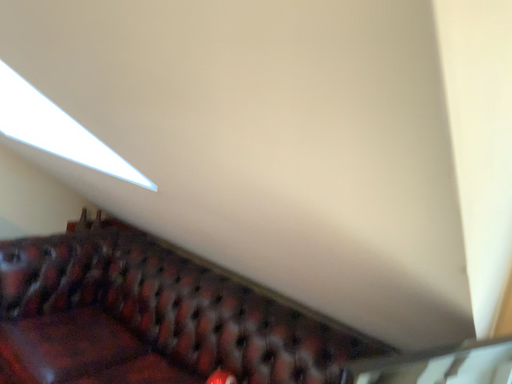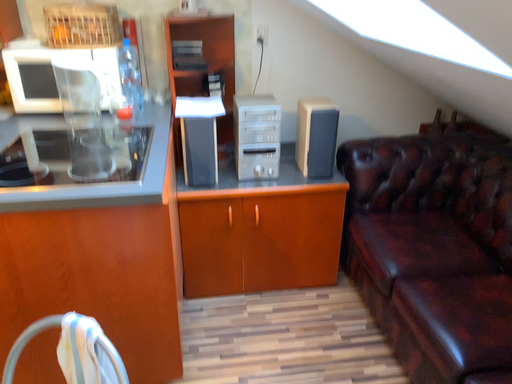
Question: Which way did the camera rotate in the video?

Choices:
 (A) rotated downward
 (B) rotated upward

Answer: (A)